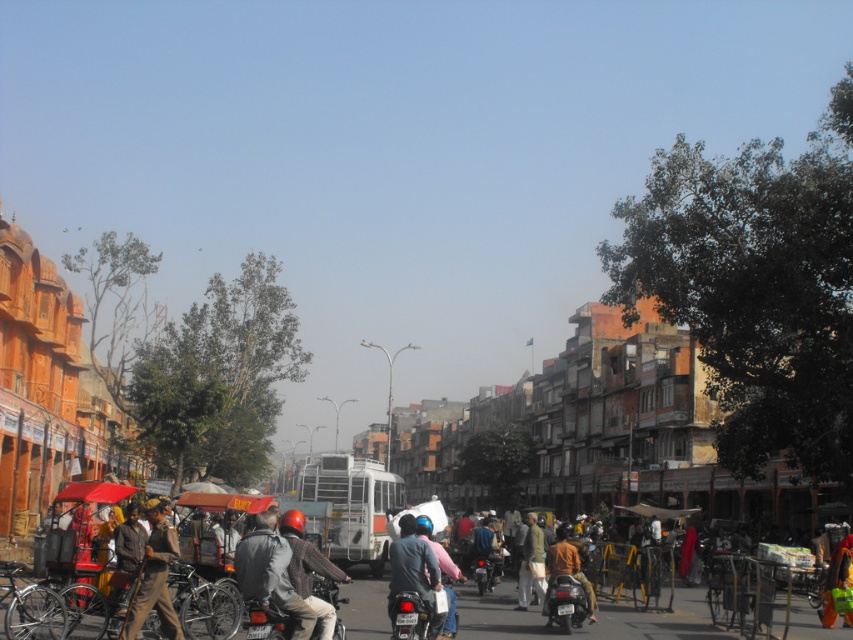
You are a delivery person who needs to place a brown fabric bag at center onto a shiny metallic motorcycle at center. Given that the distance between them is 16.37 meters, can you safely carry the bag to the motorcycle without dropping it?

The shiny metallic motorcycle at center and brown fabric bag at center are 16.37 meters apart. Since the distance is manageable for a delivery person to walk, you can safely carry the brown fabric bag at center to the shiny metallic motorcycle at center without dropping it.

You are a delivery person standing in the middle of the street. You have to place both the brown fabric bag at center and the brown leather jacket at center into a storage locker. The locker has a height limit of 1 meter. Can both items fit vertically inside the locker without exceeding the height limit?

The brown fabric bag at center is much taller than the brown leather jacket at center. Since the locker has a height limit of 1 meter, only the shorter item might fit, but we don not know their exact heights. However, since the bag is taller, if it exceeds 1 meter, the jacket could still fit. Without specific measurements, it is uncertain if both can fit.